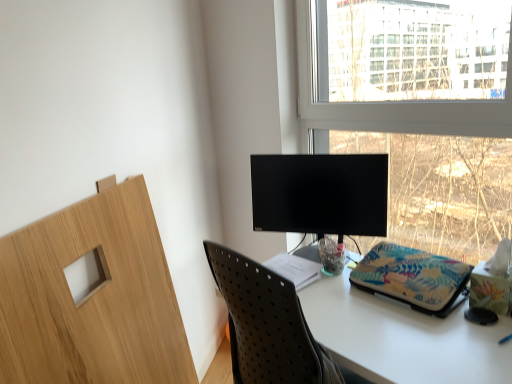
Question: Are white paper at center and transparent glass window at upper right far apart?

Choices:
 (A) yes
 (B) no

Answer: (A)

Question: Would you say white paper at center contains transparent glass window at upper right?

Choices:
 (A) no
 (B) yes

Answer: (A)

Question: From a real-world perspective, does white paper at center sit lower than transparent glass window at upper right?

Choices:
 (A) yes
 (B) no

Answer: (A)

Question: Can you confirm if white paper at center is bigger than transparent glass window at upper right?

Choices:
 (A) yes
 (B) no

Answer: (B)

Question: From a real-world perspective, does white paper at center stand above transparent glass window at upper right?

Choices:
 (A) yes
 (B) no

Answer: (B)

Question: Does white paper at center come behind transparent glass window at upper right?

Choices:
 (A) yes
 (B) no

Answer: (A)

Question: Could transparent glass window at upper right be considered to be inside floral fabric laptop sleeve at center?

Choices:
 (A) no
 (B) yes

Answer: (A)

Question: Does floral fabric laptop sleeve at center have a lesser width compared to transparent glass window at upper right?

Choices:
 (A) yes
 (B) no

Answer: (B)

Question: Is floral fabric laptop sleeve at center positioned beyond the bounds of transparent glass window at upper right?

Choices:
 (A) no
 (B) yes

Answer: (B)

Question: Is floral fabric laptop sleeve at center shorter than transparent glass window at upper right?

Choices:
 (A) yes
 (B) no

Answer: (A)

Question: Are floral fabric laptop sleeve at center and transparent glass window at upper right far apart?

Choices:
 (A) yes
 (B) no

Answer: (B)

Question: Is floral fabric laptop sleeve at center smaller than transparent glass window at upper right?

Choices:
 (A) no
 (B) yes

Answer: (B)

Question: Is floral fabric laptop sleeve at center shorter than white paper at center?

Choices:
 (A) no
 (B) yes

Answer: (A)